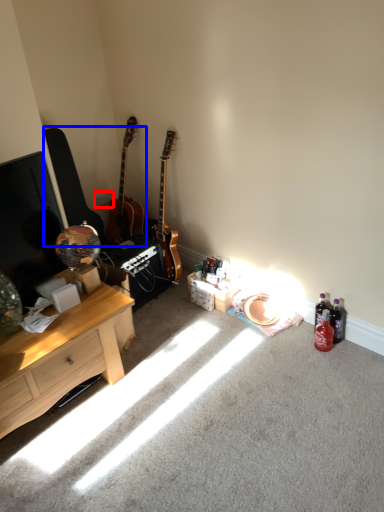
Question: Which point is closer to the camera, power outlet (highlighted by a red box) or guitars (highlighted by a blue box)?

Choices:
 (A) power outlet
 (B) guitars

Answer: (B)